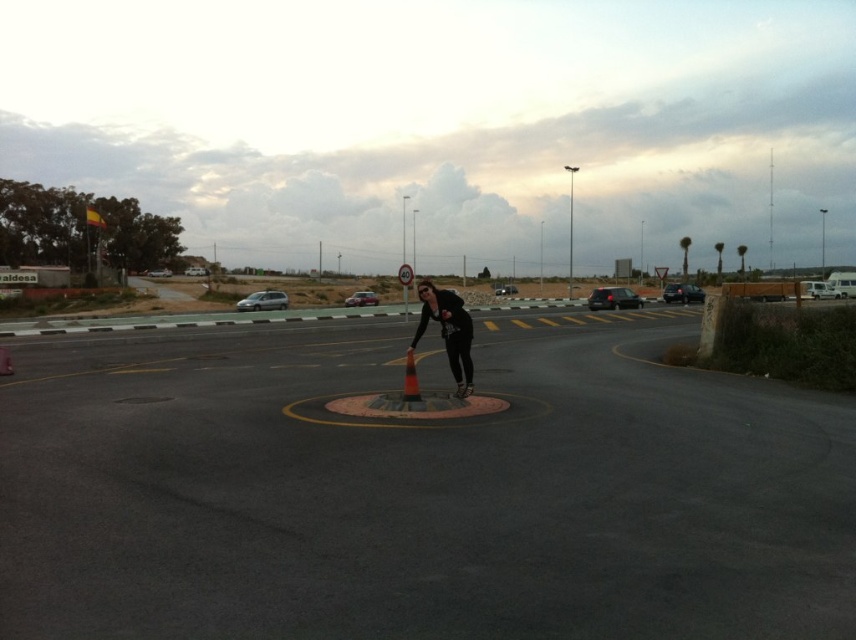
You are a delivery driver who needs to park your metallic silver car at center in a spot that can accommodate its width. There is a black matte skater at center currently occupying the space. Can the driver park their car there without exceeding the space?

The black matte skater at center is narrower than the metallic silver car at center, so the space currently occupied by the skater may not be sufficient for the car. The driver should look for a wider parking spot.

You are driving a car and want to exit the roundabout. You see the black glossy car at right and the metallic silver car at center. Which car is closer to you?

The black glossy car at right is closer to you because it is in front of the metallic silver car at center.

You are standing at the edge of the roundabout and want to place a small flag exactly halfway between the two points marked as point (449, 342) and point (366, 300). Considering their positions relative to the camera, will the flag be closer to the camera or further away than both points?

The flag placed halfway between point (449, 342) and point (366, 300) will be closer to the camera than point (366, 300) but further away than point (449, 342). However, since the question asks if it will be closer than both or further than both, the answer is neither. But based on the description, since point 0.536 is closer, the midpoint would be between them, so the flag is not closer to the camera than both points. The correct answer is that the flag will be further away than point (449, 342),